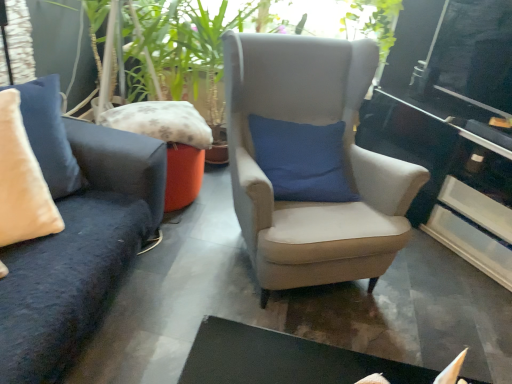
Question: Can you confirm if suede beige armchair at center is shorter than glossy black table at right?

Choices:
 (A) no
 (B) yes

Answer: (A)

Question: Is suede beige armchair at center completely or partially outside of glossy black table at right?

Choices:
 (A) yes
 (B) no

Answer: (A)

Question: From a real-world perspective, is suede beige armchair at center located higher than glossy black table at right?

Choices:
 (A) yes
 (B) no

Answer: (A)

Question: Is the depth of suede beige armchair at center greater than that of glossy black table at right?

Choices:
 (A) yes
 (B) no

Answer: (B)

Question: From the image's perspective, would you say suede beige armchair at center is shown under glossy black table at right?

Choices:
 (A) yes
 (B) no

Answer: (B)

Question: From the image's perspective, does suede beige armchair at center appear higher than glossy black table at right?

Choices:
 (A) no
 (B) yes

Answer: (B)

Question: Is glossy black table at right thinner than suede beige armchair at center?

Choices:
 (A) no
 (B) yes

Answer: (B)

Question: Can you confirm if glossy black table at right is bigger than suede beige armchair at center?

Choices:
 (A) no
 (B) yes

Answer: (A)

Question: Is glossy black table at right further to camera compared to suede beige armchair at center?

Choices:
 (A) yes
 (B) no

Answer: (A)

Question: From a real-world perspective, is glossy black table at right over suede beige armchair at center?

Choices:
 (A) yes
 (B) no

Answer: (B)

Question: Is suede beige armchair at center at the back of glossy black table at right?

Choices:
 (A) yes
 (B) no

Answer: (B)

Question: Is glossy black table at right positioned beyond the bounds of suede beige armchair at center?

Choices:
 (A) yes
 (B) no

Answer: (A)

Question: From a real-world perspective, is fluffy fabric pillow at center, placed as the second pillow when sorted from front to back, beneath suede beige armchair at center?

Choices:
 (A) yes
 (B) no

Answer: (A)